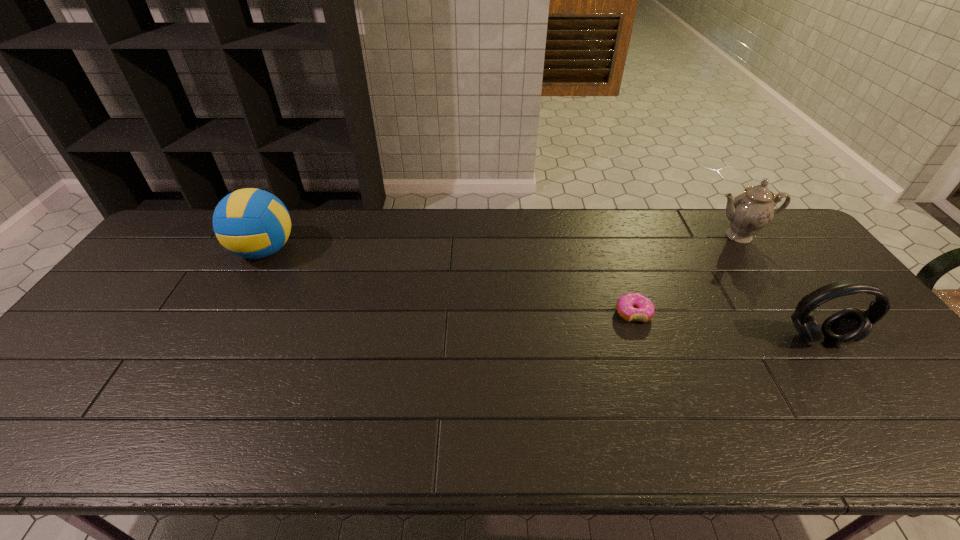
Where is `volleyball that is at the far edge`? volleyball that is at the far edge is located at coordinates (252, 223).

Where is `chinaware located at the right edge`? This screenshot has width=960, height=540. chinaware located at the right edge is located at coordinates (749, 212).

The width and height of the screenshot is (960, 540). Identify the location of headset at the right edge. (850, 325).

You are a GUI agent. You are given a task and a screenshot of the screen. Output one action in this format:
    pyautogui.click(x=<x>, y=<y>)
    Task: Click on the object present at the far right corner
    Image resolution: width=960 pixels, height=540 pixels.
    Given the screenshot: What is the action you would take?
    pyautogui.click(x=749, y=212)

You are a GUI agent. You are given a task and a screenshot of the screen. Output one action in this format:
    pyautogui.click(x=<x>, y=<y>)
    Task: Click on the free spot at the far edge of the desktop
    The height and width of the screenshot is (540, 960).
    Given the screenshot: What is the action you would take?
    pyautogui.click(x=564, y=228)

Image resolution: width=960 pixels, height=540 pixels. In order to click on free space at the near edge of the desktop in this screenshot , I will do `click(531, 436)`.

You are a GUI agent. You are given a task and a screenshot of the screen. Output one action in this format:
    pyautogui.click(x=<x>, y=<y>)
    Task: Click on the free space at the right edge
    The image size is (960, 540).
    Given the screenshot: What is the action you would take?
    pyautogui.click(x=872, y=348)

I want to click on vacant space at the far left corner, so click(155, 252).

Where is `vacant space at the near right corner of the desktop`? The image size is (960, 540). vacant space at the near right corner of the desktop is located at coordinates (901, 444).

Locate an element on the screen. The image size is (960, 540). blank region between the doughnut and the chinaware is located at coordinates (686, 274).